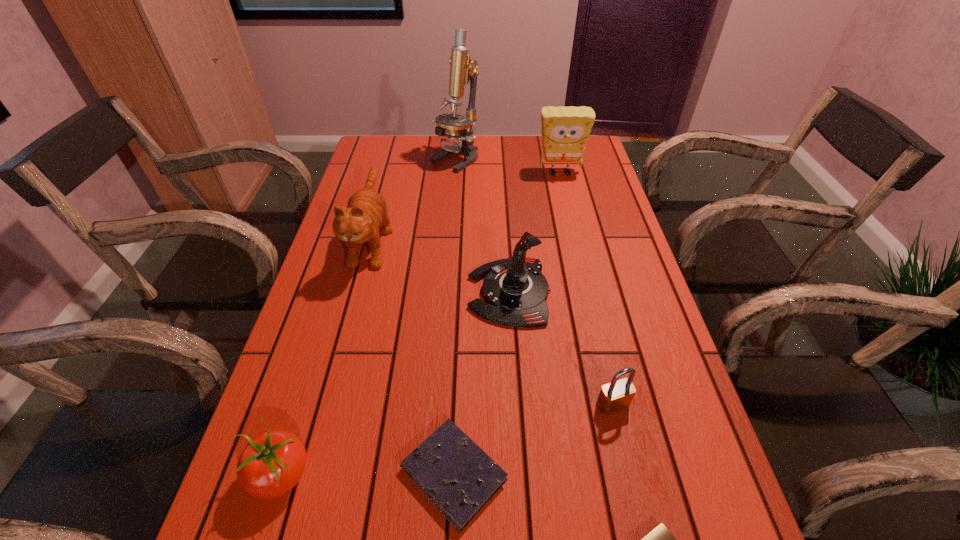
Where is `microscope`? microscope is located at coordinates (453, 126).

Locate an element on the screen. sponge is located at coordinates pos(565,131).

Identify the location of cat. The height and width of the screenshot is (540, 960). (366, 214).

This screenshot has width=960, height=540. In order to click on joystick in this screenshot , I will do `click(515, 290)`.

In order to click on the fourth nearest object in this screenshot , I will do `click(617, 395)`.

Locate an element on the screen. The height and width of the screenshot is (540, 960). the taller padlock is located at coordinates (617, 395).

Where is `tomato`? The image size is (960, 540). tomato is located at coordinates (272, 463).

Find the location of a particular element. diary is located at coordinates (459, 478).

The width and height of the screenshot is (960, 540). Identify the location of vacant area situated on the left of the tallest object. (368, 159).

Identify the location of vacant space located 0.190m on the face of the sponge. The image size is (960, 540). (570, 216).